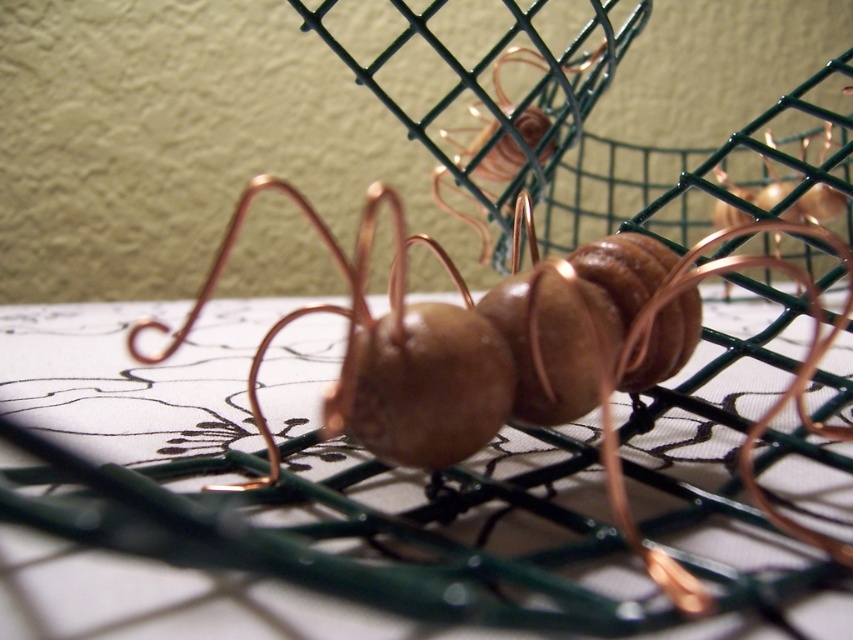
Which of these two, shiny copper wire at center or copper wire ant at center, stands taller?

copper wire ant at center

Image resolution: width=853 pixels, height=640 pixels. What are the coordinates of `shiny copper wire at center` in the screenshot? It's located at (525, 355).

What are the coordinates of `shiny copper wire at center` in the screenshot? It's located at (525, 355).